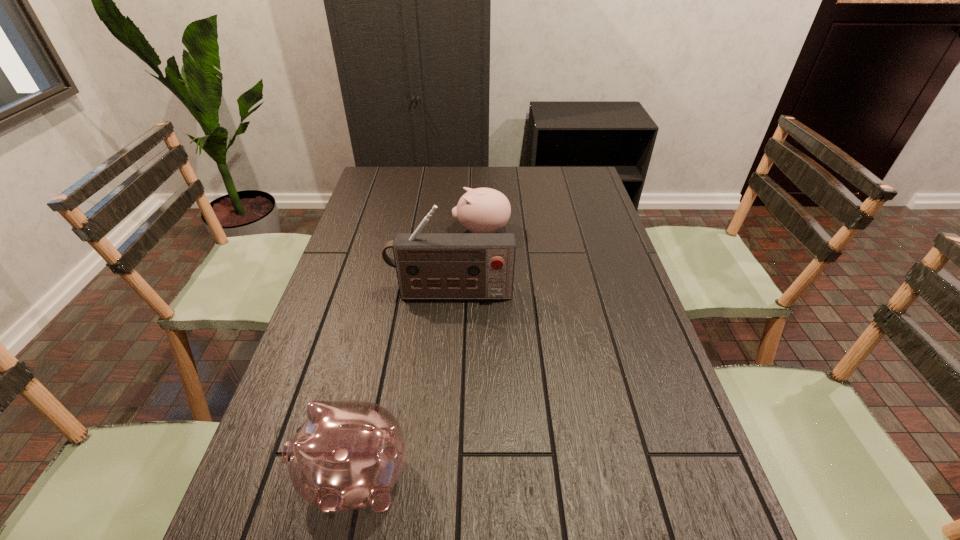
Where is `radio receiver`? radio receiver is located at coordinates (429, 265).

At what (x,y) coordinates should I click in order to perform the action: click on the tallest object. Please return your answer as a coordinate pair (x, y). The width and height of the screenshot is (960, 540). Looking at the image, I should click on (429, 265).

Identify the location of the nearest object. (348, 455).

Where is `the nearer piggy bank`? This screenshot has width=960, height=540. the nearer piggy bank is located at coordinates click(348, 455).

This screenshot has width=960, height=540. In order to click on the farther piggy bank in this screenshot , I will do `click(482, 210)`.

In order to click on the shortest object in this screenshot , I will do `click(482, 210)`.

Where is `vacant space located 0.050m on the front panel of the radio receiver`? The width and height of the screenshot is (960, 540). vacant space located 0.050m on the front panel of the radio receiver is located at coordinates (449, 315).

At what (x,y) coordinates should I click in order to perform the action: click on vacant space located on the front facing side of the taller piggy bank. Please return your answer as a coordinate pair (x, y). The image size is (960, 540). Looking at the image, I should click on (259, 477).

Locate an element on the screen. The image size is (960, 540). free spot located 0.070m on the front facing side of the taller piggy bank is located at coordinates (264, 477).

Identify the location of blank space located 0.270m at the snout of the farther piggy bank. (374, 231).